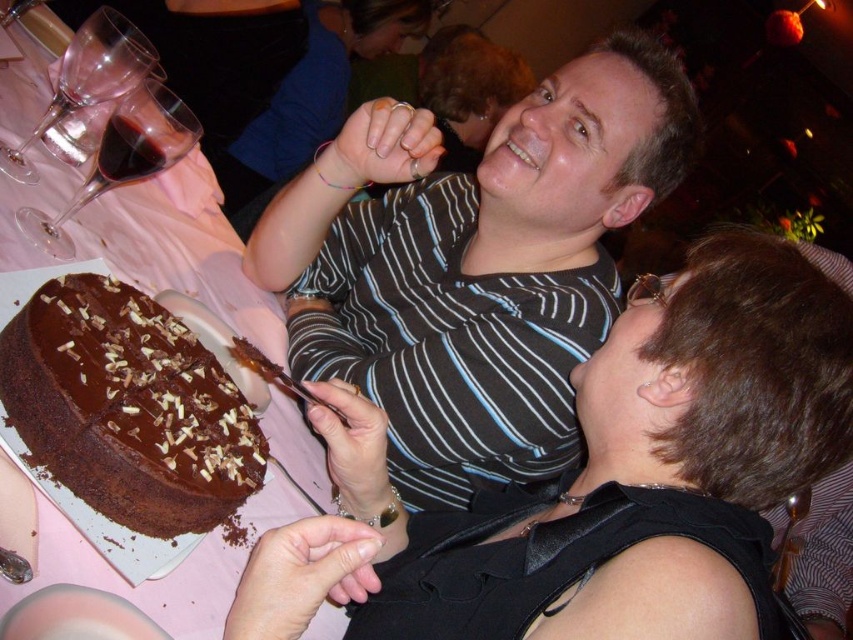
You are at the celebration and want to take a photo of the striped shirt at upper center without the chocolatesmoothcake at left appearing in the background. Is this possible based on the scene?

The chocolatesmoothcake at left is behind the striped shirt at upper center, so if you position yourself so that the striped shirt is between you and the cake, the cake won t be visible in the photo.

You are at a social gathering and see two points marked in the image. The first point is at coordinates point (701, 589) and the second point is at point (61, 385). Which point is closer to you?

Point (701, 589) is in front of point (61, 385), so the first point is closer to you.

What is located at the coordinates point (614, 477) in the image?

The point (614, 477) corresponds to black fabric at center.